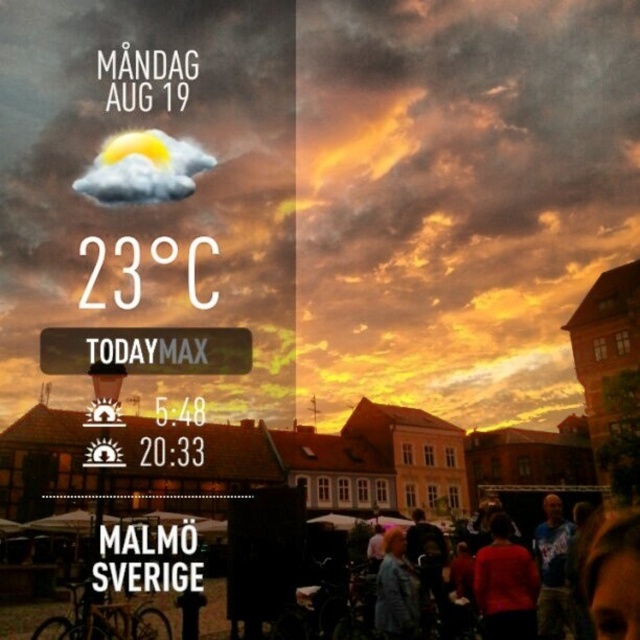
Question: Can you confirm if cloudytexturedsky at upper center is positioned above matte red sweater at lower right?

Choices:
 (A) no
 (B) yes

Answer: (B)

Question: Which object is the closest to the blue tie-dye shirt at lower right?

Choices:
 (A) cloudytexturedsky at upper center
 (B) matte orange sky at center

Answer: (B)

Question: Which point appears closest to the camera in this image?

Choices:
 (A) (400, 620)
 (B) (561, 592)
 (C) (230, 97)

Answer: (A)

Question: Can you confirm if matte red sweater at lower right is thinner than blue tie-dye shirt at lower right?

Choices:
 (A) yes
 (B) no

Answer: (A)

Question: Which point is closer to the camera?

Choices:
 (A) white plastic sign at center
 (B) cloudytexturedsky at upper center
 (C) blue tie-dye shirt at lower right
 (D) matte red sweater at lower right

Answer: (B)

Question: Can you confirm if cloudytexturedsky at upper center is positioned to the left of denim jacket at lower right?

Choices:
 (A) yes
 (B) no

Answer: (A)